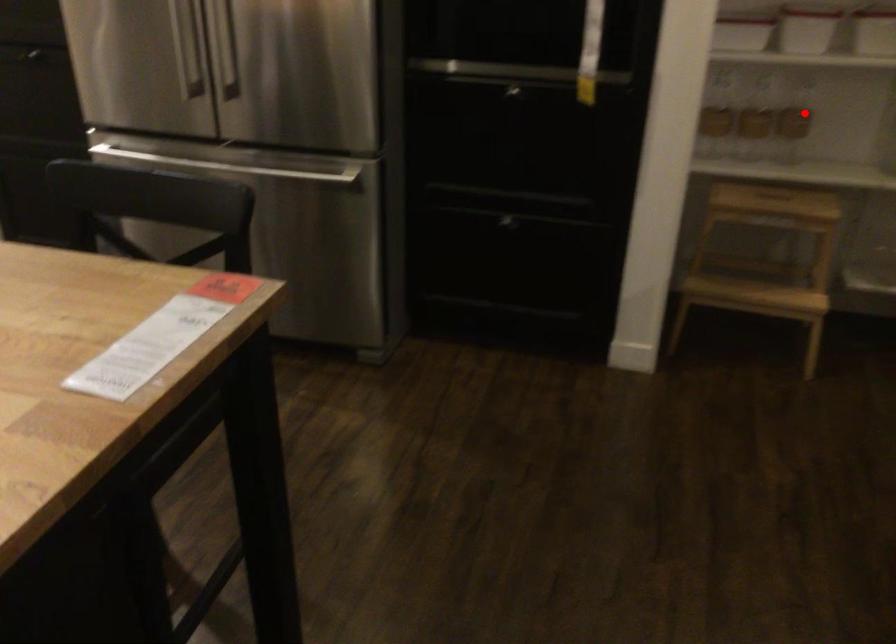
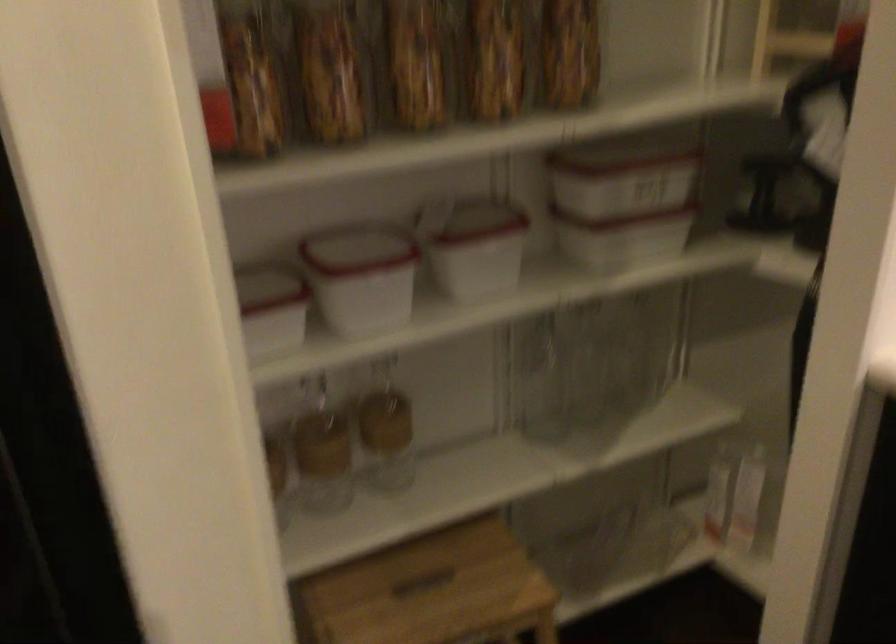
Locate, in the second image, the point that corresponds to the highlighted location in the first image.

(385, 430)